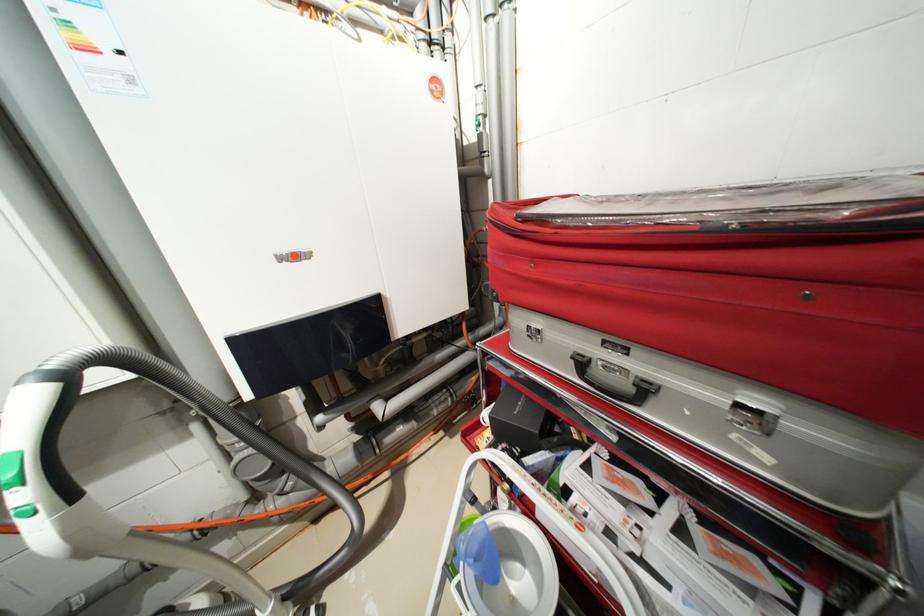
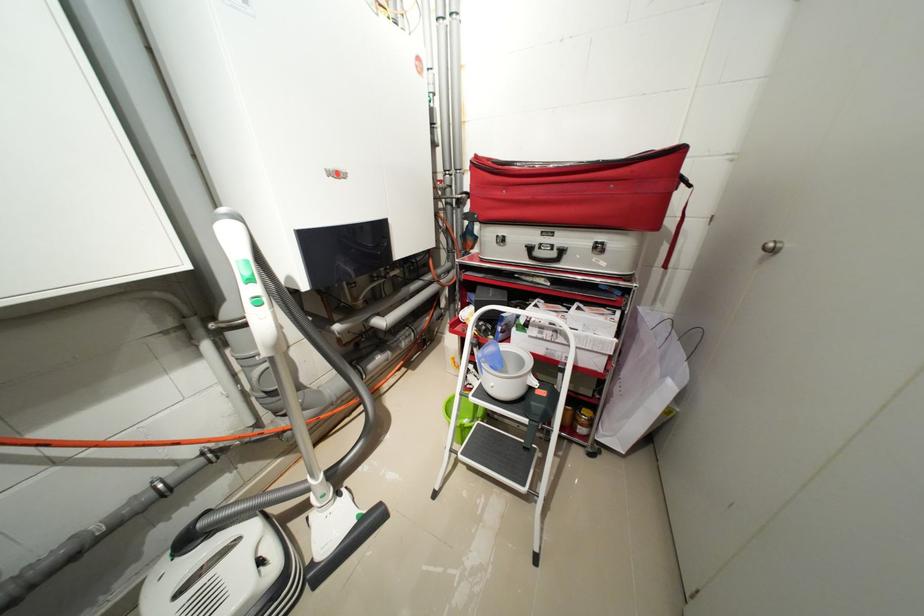
Question: The camera is either moving clockwise (left) or counter-clockwise (right) around the object. The first image is from the beginning of the video and the second image is from the end. Is the camera moving left or right when shooting the video?

Choices:
 (A) Left
 (B) Right

Answer: (A)